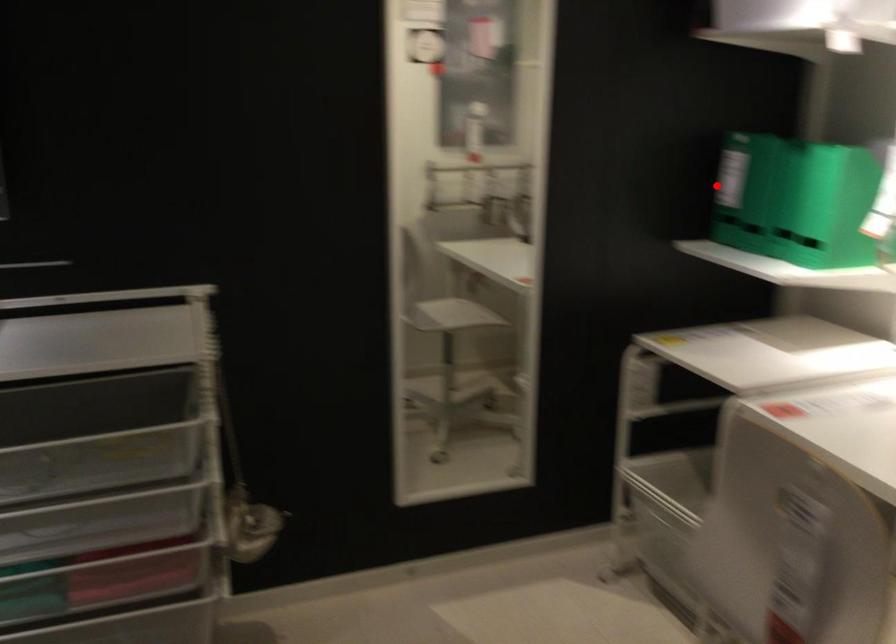
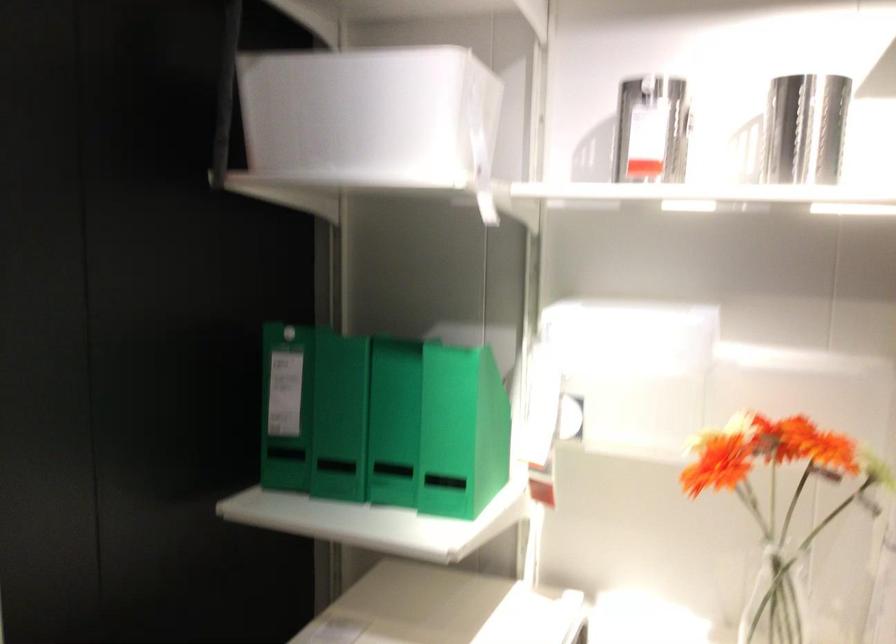
Question: I am providing you with two images of the same scene from different viewpoints. Image1 has a red point marked. In image2, the corresponding 3D location appears at what relative position? Reply with the corresponding letter.

Choices:
 (A) Closer
 (B) Farther

Answer: (A)